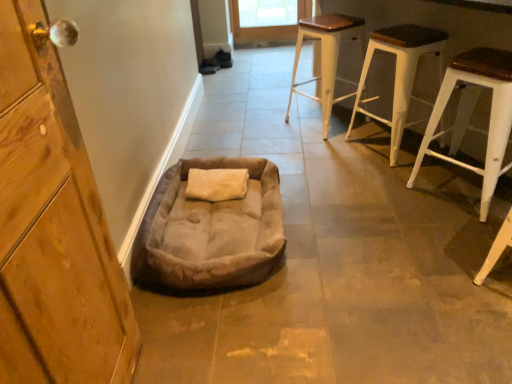
Image resolution: width=512 pixels, height=384 pixels. Describe the element at coordinates (472, 112) in the screenshot. I see `white wood stool at right, which appears as the first stool when viewed from the right` at that location.

Identify the location of wooden door at left. The height and width of the screenshot is (384, 512). (53, 228).

Describe the element at coordinates (400, 73) in the screenshot. The height and width of the screenshot is (384, 512). I see `white wood stool at upper right, which ranks as the 2th stool in right-to-left order` at that location.

What do you see at coordinates (210, 231) in the screenshot?
I see `suede-like beige dog bed at lower center` at bounding box center [210, 231].

The width and height of the screenshot is (512, 384). In order to click on white wood stool at right, which appears as the first stool when viewed from the right in this screenshot , I will do `click(472, 112)`.

You are a GUI agent. You are given a task and a screenshot of the screen. Output one action in this format:
    pyautogui.click(x=<x>, y=<y>)
    Task: Click on the stool below the white wood stool at upper right, which is the 1th stool from left to right (from a real-world perspective)
    This screenshot has width=512, height=384.
    Given the screenshot: What is the action you would take?
    pyautogui.click(x=472, y=112)

Does white wood stool at right, which appears as the first stool when viewed from the right, touch white wood stool at upper right, which is the 1th stool from left to right?

No, white wood stool at right, which appears as the first stool when viewed from the right, is not beside white wood stool at upper right, which is the 1th stool from left to right.

Is white wood stool at right, the 3th stool from the left, shorter than white wood stool at upper right, which is the 1th stool from left to right?

Correct, white wood stool at right, the 3th stool from the left, is not as tall as white wood stool at upper right, which is the 1th stool from left to right.

How many degrees apart are the facing directions of white wood stool at right, the 3th stool from the left, and white wood stool at upper right, which is the 1th stool from left to right?

They differ by 2.34 degrees in their facing directions.

Considering the sizes of objects white wood stool at upper right, which ranks as the 2th stool in right-to-left order, and white wood stool at upper right, acting as the third stool starting from the right, in the image provided, who is smaller, white wood stool at upper right, which ranks as the 2th stool in right-to-left order, or white wood stool at upper right, acting as the third stool starting from the right,?

Smaller between the two is white wood stool at upper right, which ranks as the 2th stool in right-to-left order.

Could you tell me if white wood stool at upper right, which ranks as the 2th stool in right-to-left order, is turned towards white wood stool at upper right, acting as the third stool starting from the right?

No, white wood stool at upper right, which ranks as the 2th stool in right-to-left order, does not turn towards white wood stool at upper right, acting as the third stool starting from the right.

The image size is (512, 384). Find the location of `stool lying behind the white wood stool at upper right, which ranks as the 2th stool in right-to-left order`. stool lying behind the white wood stool at upper right, which ranks as the 2th stool in right-to-left order is located at coordinates (326, 57).

From the image's perspective, is wooden door at left below white wood stool at right, the 3th stool from the left?

Indeed, from the image's perspective, wooden door at left is shown beneath white wood stool at right, the 3th stool from the left.

Does point (68, 301) come closer to viewer compared to point (453, 131)?

That is True.

Looking at this image, what's the angular difference between wooden door at left and white wood stool at right, which appears as the first stool when viewed from the right,'s facing directions?

The angular difference between wooden door at left and white wood stool at right, which appears as the first stool when viewed from the right, is 39.5 degrees.

Is wooden door at left wider or thinner than white wood stool at right, the 3th stool from the left?

wooden door at left is thinner than white wood stool at right, the 3th stool from the left.

Does white wood stool at upper right, which ranks as the 2th stool in right-to-left order, touch wooden door at left?

No.

From the image's perspective, between white wood stool at upper right, which ranks as the 2th stool in right-to-left order, and wooden door at left, which one is located above?

white wood stool at upper right, which ranks as the 2th stool in right-to-left order, is shown above in the image.

How much distance is there between white wood stool at upper right, placed as the 2th stool when sorted from left to right, and wooden door at left?

white wood stool at upper right, placed as the 2th stool when sorted from left to right, is 1.83 meters away from wooden door at left.

Is white wood stool at upper right, placed as the 2th stool when sorted from left to right, located outside wooden door at left?

Yes, white wood stool at upper right, placed as the 2th stool when sorted from left to right, is located beyond the bounds of wooden door at left.

Measure the distance from suede-like beige dog bed at lower center to white wood stool at upper right, acting as the third stool starting from the right.

A distance of 1.06 meters exists between suede-like beige dog bed at lower center and white wood stool at upper right, acting as the third stool starting from the right.

Based on the photo, considering the sizes of suede-like beige dog bed at lower center and white wood stool at upper right, which is the 1th stool from left to right, in the image, is suede-like beige dog bed at lower center wider or thinner than white wood stool at upper right, which is the 1th stool from left to right,?

Considering their sizes, suede-like beige dog bed at lower center looks broader than white wood stool at upper right, which is the 1th stool from left to right.

Considering the relative sizes of suede-like beige dog bed at lower center and white wood stool at upper right, which is the 1th stool from left to right, in the image provided, is suede-like beige dog bed at lower center smaller than white wood stool at upper right, which is the 1th stool from left to right,?

Correct, suede-like beige dog bed at lower center occupies less space than white wood stool at upper right, which is the 1th stool from left to right.

Which is more to the right, suede-like beige dog bed at lower center or white wood stool at upper right, which is the 1th stool from left to right?

white wood stool at upper right, which is the 1th stool from left to right, is more to the right.

Is white wood stool at upper right, which ranks as the 2th stool in right-to-left order, positioned with its back to white wood stool at right, which appears as the first stool when viewed from the right?

white wood stool at upper right, which ranks as the 2th stool in right-to-left order, is not turned away from white wood stool at right, which appears as the first stool when viewed from the right.

Does white wood stool at upper right, placed as the 2th stool when sorted from left to right, have a smaller size compared to white wood stool at right, the 3th stool from the left?

Correct, white wood stool at upper right, placed as the 2th stool when sorted from left to right, occupies less space than white wood stool at right, the 3th stool from the left.

Would you say white wood stool at right, the 3th stool from the left, is part of white wood stool at upper right, which ranks as the 2th stool in right-to-left order,'s contents?

Actually, white wood stool at right, the 3th stool from the left, is outside white wood stool at upper right, which ranks as the 2th stool in right-to-left order.

From a real-world perspective, which object stands above the other?

wooden door at left, from a real-world perspective.

Looking at this image, from the image's perspective, is wooden door at left under suede-like beige dog bed at lower center?

Indeed, from the image's perspective, wooden door at left is shown beneath suede-like beige dog bed at lower center.

Considering the sizes of objects wooden door at left and suede-like beige dog bed at lower center in the image provided, who is wider, wooden door at left or suede-like beige dog bed at lower center?

suede-like beige dog bed at lower center.

Between wooden door at left and suede-like beige dog bed at lower center, which one has less height?

Standing shorter between the two is suede-like beige dog bed at lower center.

Image resolution: width=512 pixels, height=384 pixels. I want to click on the 2nd stool behind the white wood stool at right, the 3th stool from the left, counting from the anchor's position, so click(326, 57).

Where is `stool that appears above the white wood stool at upper right, which ranks as the 2th stool in right-to-left order (from the image's perspective)`? The image size is (512, 384). stool that appears above the white wood stool at upper right, which ranks as the 2th stool in right-to-left order (from the image's perspective) is located at coordinates (326, 57).

When comparing their distances from suede-like beige dog bed at lower center, does white wood stool at right, the 3th stool from the left, or white wood stool at upper right, which ranks as the 2th stool in right-to-left order, seem further?

white wood stool at upper right, which ranks as the 2th stool in right-to-left order, is positioned further to the anchor suede-like beige dog bed at lower center.

Consider the image. Estimate the real-world distances between objects in this image. Which object is closer to white wood stool at right, the 3th stool from the left, wooden door at left or white wood stool at upper right, which is the 1th stool from left to right?

Based on the image, white wood stool at upper right, which is the 1th stool from left to right, appears to be nearer to white wood stool at right, the 3th stool from the left.

From the image, which object appears to be nearer to suede-like beige dog bed at lower center, white wood stool at upper right, placed as the 2th stool when sorted from left to right, or white wood stool at upper right, which is the 1th stool from left to right?

The object closer to suede-like beige dog bed at lower center is white wood stool at upper right, placed as the 2th stool when sorted from left to right.

From the image, which object appears to be farther from white wood stool at upper right, placed as the 2th stool when sorted from left to right, white wood stool at upper right, acting as the third stool starting from the right, or suede-like beige dog bed at lower center?

Based on the image, suede-like beige dog bed at lower center appears to be further to white wood stool at upper right, placed as the 2th stool when sorted from left to right.

Estimate the real-world distances between objects in this image. Which object is closer to white wood stool at right, the 3th stool from the left, white wood stool at upper right, which is the 1th stool from left to right, or suede-like beige dog bed at lower center?

white wood stool at upper right, which is the 1th stool from left to right.

Estimate the real-world distances between objects in this image. Which object is further from white wood stool at right, which appears as the first stool when viewed from the right, white wood stool at upper right, acting as the third stool starting from the right, or white wood stool at upper right, which ranks as the 2th stool in right-to-left order?

white wood stool at upper right, acting as the third stool starting from the right.

When comparing their distances from white wood stool at upper right, which is the 1th stool from left to right, does wooden door at left or white wood stool at right, which appears as the first stool when viewed from the right, seem further?

Based on the image, wooden door at left appears to be further to white wood stool at upper right, which is the 1th stool from left to right.

When comparing their distances from white wood stool at upper right, which is the 1th stool from left to right, does wooden door at left or white wood stool at upper right, which ranks as the 2th stool in right-to-left order, seem further?

wooden door at left.

I want to click on stool between suede-like beige dog bed at lower center and white wood stool at upper right, which ranks as the 2th stool in right-to-left order, so tap(326, 57).

In order to click on dog bed between wooden door at left and white wood stool at upper right, placed as the 2th stool when sorted from left to right, along the z-axis in this screenshot , I will do `click(210, 231)`.

Where is `dog bed between wooden door at left and white wood stool at upper right, acting as the third stool starting from the right, in the front-back direction`? dog bed between wooden door at left and white wood stool at upper right, acting as the third stool starting from the right, in the front-back direction is located at coordinates (210, 231).

Where is `dog bed located between wooden door at left and white wood stool at right, the 3th stool from the left, in the left-right direction`? The height and width of the screenshot is (384, 512). dog bed located between wooden door at left and white wood stool at right, the 3th stool from the left, in the left-right direction is located at coordinates (210, 231).